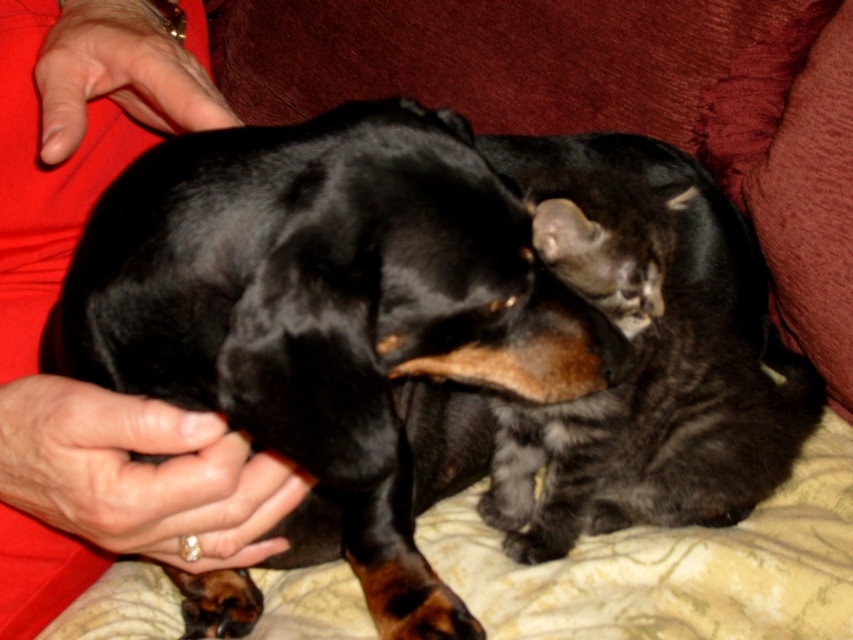
Who is positioned more to the right, smooth red shirt at upper left or dark gray fur at upper right?

Positioned to the right is dark gray fur at upper right.

This screenshot has width=853, height=640. Describe the element at coordinates (54, 300) in the screenshot. I see `smooth red shirt at upper left` at that location.

Does point (15, 156) lie behind point (553, 545)?

That is False.

Where is `smooth red shirt at upper left`? smooth red shirt at upper left is located at coordinates (54, 300).

Who is taller, black shiny dog at center or smooth red shirt at upper left?

Standing taller between the two is smooth red shirt at upper left.

Identify the location of black shiny dog at center. The width and height of the screenshot is (853, 640). (335, 321).

Is black shiny dog at center wider than dark gray fur at upper right?

Yes.

Who is lower down, black shiny dog at center or dark gray fur at upper right?

black shiny dog at center

The image size is (853, 640). Identify the location of black shiny dog at center. (335, 321).